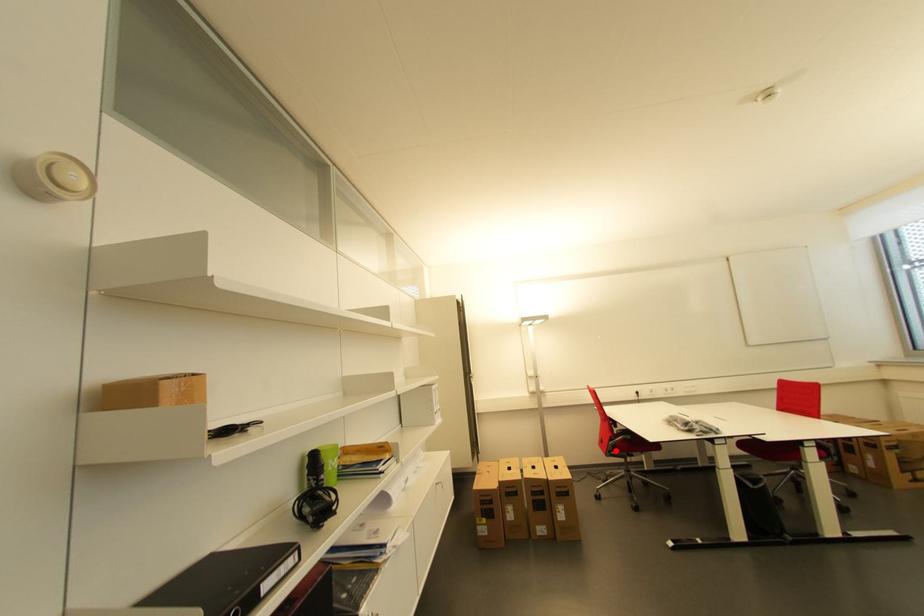
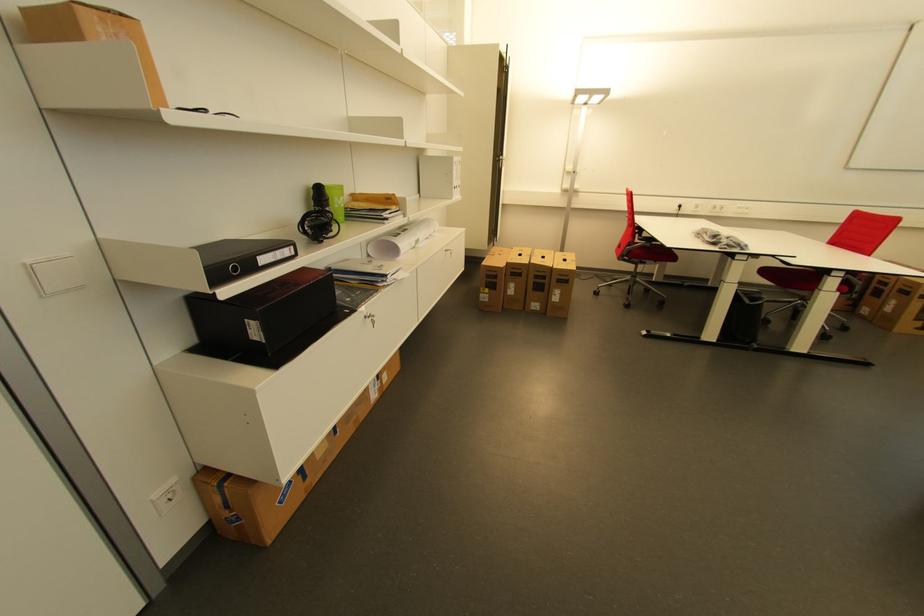
Question: I am providing you with two images of the same scene from different viewpoints. Given a red point in image1, look at the same physical point in image2. Is it:

Choices:
 (A) Closer to the viewpoint
 (B) Farther from the viewpoint

Answer: (A)